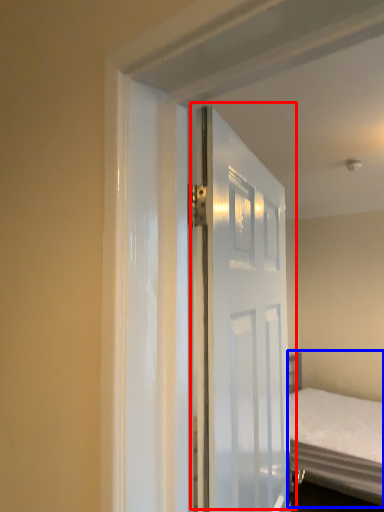
Question: Which point is further to the camera, door (highlighted by a red box) or bed (highlighted by a blue box)?

Choices:
 (A) door
 (B) bed

Answer: (B)